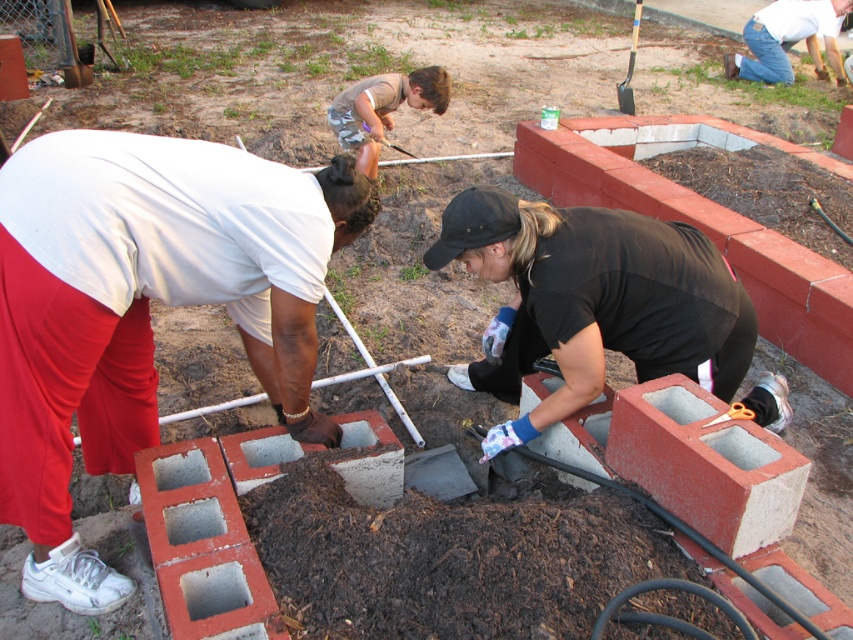
Question: Is jeans at upper right bigger than wooden handle shovel at upper right?

Choices:
 (A) no
 (B) yes

Answer: (A)

Question: Where is matte white shirt at left located in relation to wooden handle shovel at upper right in the image?

Choices:
 (A) below
 (B) above

Answer: (A)

Question: Which object is positioned farthest from the jeans at upper right?

Choices:
 (A) matte white shirt at left
 (B) wooden handle shovel at upper right

Answer: (A)

Question: Which point is farther from the camera taking this photo?

Choices:
 (A) (755, 45)
 (B) (57, 321)
 (C) (722, 417)
 (D) (631, 26)

Answer: (D)

Question: Among these points, which one is nearest to the camera?

Choices:
 (A) (738, 413)
 (B) (584, 205)

Answer: (A)

Question: Can you confirm if matte white shirt at left is positioned above wooden handle shovel at upper right?

Choices:
 (A) yes
 (B) no

Answer: (B)